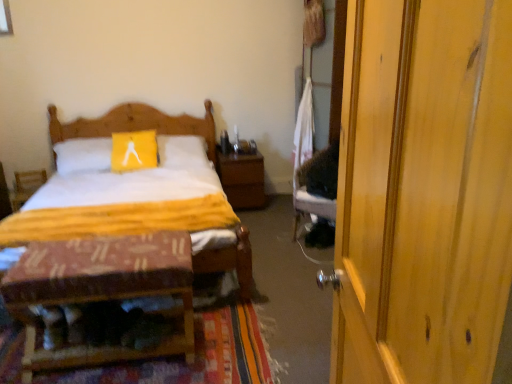
What do you see at coordinates (121, 205) in the screenshot? This screenshot has height=384, width=512. I see `yellow cotton quilt at center` at bounding box center [121, 205].

This screenshot has height=384, width=512. What do you see at coordinates (136, 124) in the screenshot?
I see `wooden bed at center` at bounding box center [136, 124].

Locate an element on the screen. wooden bed at center is located at coordinates point(136,124).

Where is `wooden door at right`? wooden door at right is located at coordinates click(423, 192).

Describe the element at coordinates (100, 290) in the screenshot. This screenshot has height=384, width=512. I see `wooden patterned stool at lower left` at that location.

This screenshot has height=384, width=512. Describe the element at coordinates (27, 186) in the screenshot. I see `wooden armchair at left` at that location.

Where is `yellow cotton quilt at center`? yellow cotton quilt at center is located at coordinates (121, 205).

Based on the photo, is wooden patterned stool at lower left taller or shorter than wooden door at right?

wooden patterned stool at lower left is shorter than wooden door at right.

Is point (42, 253) in front of point (404, 296)?

No, (42, 253) is further to viewer.

Is the position of wooden patterned stool at lower left more distant than that of wooden door at right?

Yes.

Based on the photo, is wooden patterned stool at lower left wider or thinner than wooden door at right?

In the image, wooden patterned stool at lower left appears to be wider than wooden door at right.

Does point (109, 198) come behind point (33, 176)?

No, it is in front of (33, 176).

Does yellow cotton quilt at center have a greater height compared to wooden armchair at left?

In fact, yellow cotton quilt at center may be shorter than wooden armchair at left.

From a real-world perspective, relative to wooden armchair at left, is yellow cotton quilt at center vertically above or below?

From a real-world perspective, yellow cotton quilt at center is physically above wooden armchair at left.

Is yellow cotton quilt at center positioned with its back to wooden armchair at left?

No, wooden armchair at left is not at the back of yellow cotton quilt at center.

Does wooden armchair at left turn towards yellow cotton quilt at center?

Yes, wooden armchair at left is oriented towards yellow cotton quilt at center.

Does wooden armchair at left have a larger size compared to yellow cotton quilt at center?

No.

Image resolution: width=512 pixels, height=384 pixels. What are the coordinates of `armchair beneath the yellow cotton quilt at center (from a real-world perspective)` in the screenshot? It's located at (27, 186).

From the image's perspective, which one is positioned higher, wooden armchair at left or yellow cotton quilt at center?

wooden armchair at left.

In the image, is wooden patterned stool at lower left positioned in front of or behind wooden armchair at left?

wooden patterned stool at lower left is in front of wooden armchair at left.

From a real-world perspective, is wooden patterned stool at lower left physically above wooden armchair at left?

Indeed, from a real-world perspective, wooden patterned stool at lower left stands above wooden armchair at left.

Could wooden armchair at left be considered to be inside wooden patterned stool at lower left?

That's incorrect, wooden armchair at left is not inside wooden patterned stool at lower left.

The image size is (512, 384). I want to click on table below the wooden armchair at left (from the image's perspective), so click(x=100, y=290).

Between textured woolen mat at lower left and wooden door at right, which one has smaller size?

Smaller between the two is textured woolen mat at lower left.

Is textured woolen mat at lower left oriented away from wooden door at right?

No.

Is textured woolen mat at lower left inside the boundaries of wooden door at right, or outside?

textured woolen mat at lower left cannot be found inside wooden door at right.

Is point (248, 195) closer or farther from the camera than point (445, 140)?

Clearly, point (248, 195) is more distant from the camera than point (445, 140).

Locate an element on the screen. The height and width of the screenshot is (384, 512). nightstand that is above the wooden door at right (from the image's perspective) is located at coordinates (242, 179).

From a real-world perspective, which object stands above the other?

wooden door at right is physically above.

Where is `mat that is in front of the wooden armchair at left`? mat that is in front of the wooden armchair at left is located at coordinates (196, 356).

Can you confirm if textured woolen mat at lower left is positioned to the left of wooden armchair at left?

No, textured woolen mat at lower left is not to the left of wooden armchair at left.

Does textured woolen mat at lower left contain wooden armchair at left?

No, textured woolen mat at lower left does not contain wooden armchair at left.

Does point (149, 379) come in front of point (38, 176)?

Yes, it is.

Find the location of `door that is above the wooden patterned stool at lower left (from a real-world perspective)`. door that is above the wooden patterned stool at lower left (from a real-world perspective) is located at coordinates (423, 192).

In the image, there is a yellow cotton quilt at center. In order to click on armchair above it (from the image's perspective) in this screenshot , I will do `click(27, 186)`.

Considering their positions, is wooden door at right positioned closer to textured woolen mat at lower left than wooden nightstand at center?

The object closer to textured woolen mat at lower left is wooden door at right.

When comparing their distances from yellow cotton quilt at center, does wooden patterned stool at lower left or wooden armchair at left seem further?

wooden armchair at left lies further to yellow cotton quilt at center than the other object.

Based on the photo, when comparing their distances from wooden door at right, does wooden nightstand at center or wooden patterned stool at lower left seem closer?

wooden patterned stool at lower left is positioned closer to the anchor wooden door at right.

From the image, which object appears to be farther from wooden nightstand at center, yellow cotton quilt at center or wooden bed at center?

yellow cotton quilt at center is positioned further to the anchor wooden nightstand at center.

When comparing their distances from wooden patterned stool at lower left, does textured woolen mat at lower left or yellow cotton quilt at center seem closer?

The object closer to wooden patterned stool at lower left is textured woolen mat at lower left.

When comparing their distances from wooden door at right, does wooden nightstand at center or wooden bed at center seem closer?

Among the two, wooden nightstand at center is located nearer to wooden door at right.

From the image, which object appears to be farther from wooden door at right, wooden armchair at left or textured woolen mat at lower left?

The object further to wooden door at right is wooden armchair at left.

When comparing their distances from wooden patterned stool at lower left, does textured woolen mat at lower left or wooden door at right seem closer?

textured woolen mat at lower left is closer to wooden patterned stool at lower left.

The height and width of the screenshot is (384, 512). I want to click on bed located between wooden door at right and wooden nightstand at center in the depth direction, so click(136, 124).

I want to click on armchair positioned between textured woolen mat at lower left and wooden nightstand at center from near to far, so click(x=27, y=186).

Identify the location of quilt located between wooden patterned stool at lower left and wooden nightstand at center in the depth direction. The height and width of the screenshot is (384, 512). (121, 205).

I want to click on table positioned between textured woolen mat at lower left and wooden nightstand at center from near to far, so click(x=100, y=290).